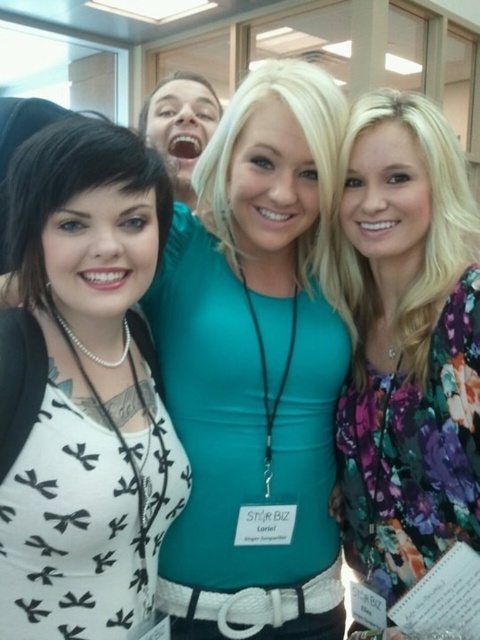
Question: Which is farther from the white matte shirt at center?

Choices:
 (A) floral print blouse at right
 (B) white matte/black textured bow tie at center

Answer: (B)

Question: Is white matte shirt at center thinner than white matte/black textured bow tie at center?

Choices:
 (A) no
 (B) yes

Answer: (A)

Question: Among these points, which one is farthest from the camera?

Choices:
 (A) (261, 620)
 (B) (126, 148)

Answer: (A)

Question: Can you confirm if white matte/black textured bow tie at center is positioned below floral print blouse at right?

Choices:
 (A) yes
 (B) no

Answer: (A)

Question: Does white matte/black textured bow tie at center have a greater width compared to floral print blouse at right?

Choices:
 (A) no
 (B) yes

Answer: (A)

Question: Which of the following is the farthest from the observer?

Choices:
 (A) (81, 564)
 (B) (394, 352)

Answer: (B)